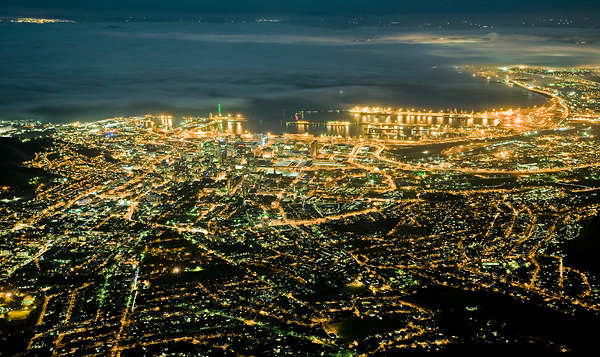
The width and height of the screenshot is (600, 357). In order to click on orange lights in this screenshot , I will do `click(17, 315)`, `click(32, 303)`, `click(12, 297)`, `click(330, 331)`.